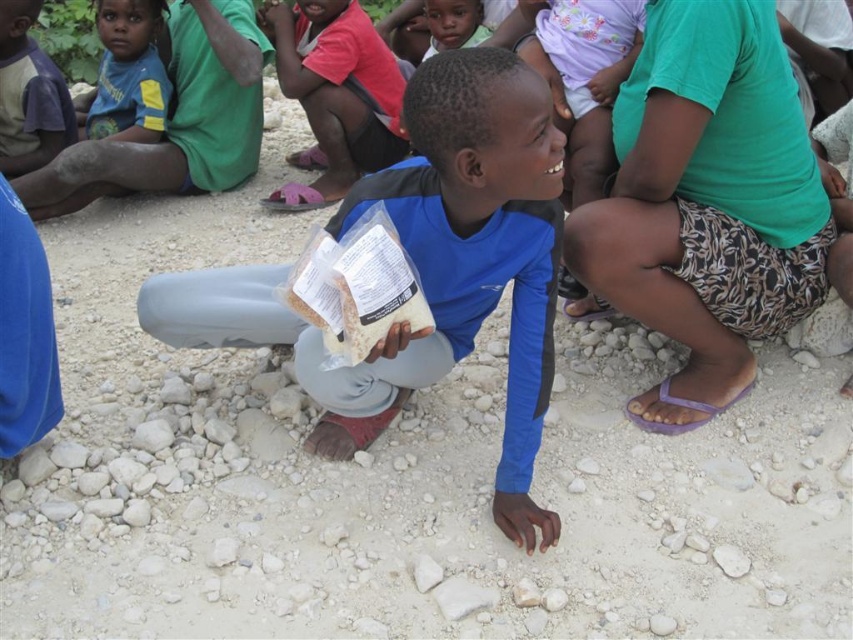
Can you confirm if blue matte shirt at center is wider than green fabric shorts at right?

Yes.

Does point (509, 278) come in front of point (662, 259)?

Yes.

Identify the location of blue matte shirt at center. This screenshot has width=853, height=640. (425, 269).

At what (x,y) coordinates should I click in order to perform the action: click on blue matte shirt at center. Please return your answer as a coordinate pair (x, y). This screenshot has height=640, width=853. Looking at the image, I should click on (425, 269).

Does point (126, 35) come in front of point (466, 24)?

Yes, point (126, 35) is closer to viewer.

Does blue t-shirt at upper left have a lesser width compared to smooth skin child at center?

Incorrect, blue t-shirt at upper left's width is not less than smooth skin child at center's.

Is point (122, 97) positioned after point (431, 45)?

That is False.

You are a GUI agent. You are given a task and a screenshot of the screen. Output one action in this format:
    pyautogui.click(x=<x>, y=<y>)
    Task: Click on the blue t-shirt at upper left
    
    Given the screenshot: What is the action you would take?
    pyautogui.click(x=128, y=74)

Does blue matte shirt at center have a smaller size compared to blue t-shirt at upper left?

Actually, blue matte shirt at center might be larger than blue t-shirt at upper left.

Who is more forward, (526, 358) or (111, 80)?

Point (526, 358) is more forward.

Is point (477, 282) farther from camera compared to point (100, 97)?

No, (477, 282) is in front of (100, 97).

The image size is (853, 640). I want to click on blue matte shirt at center, so click(x=425, y=269).